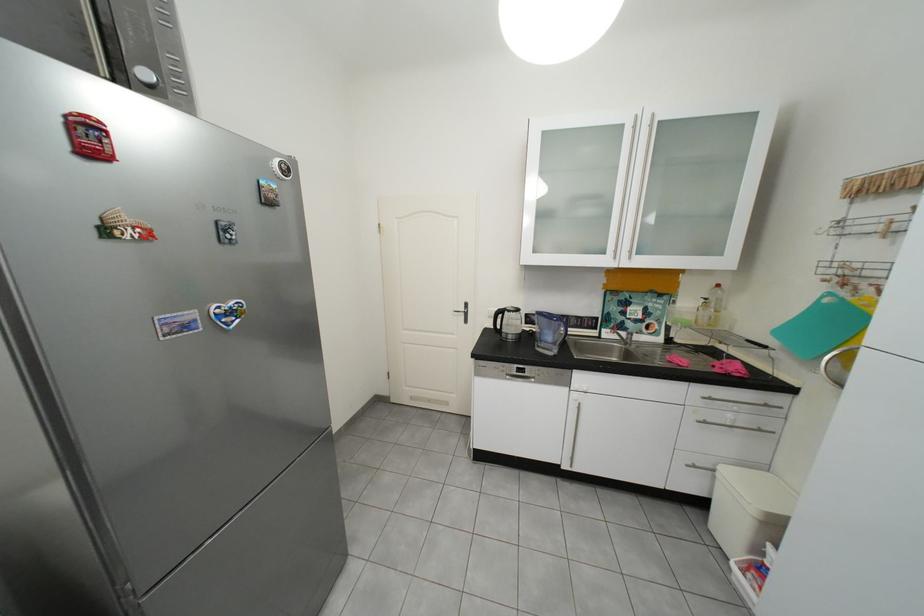
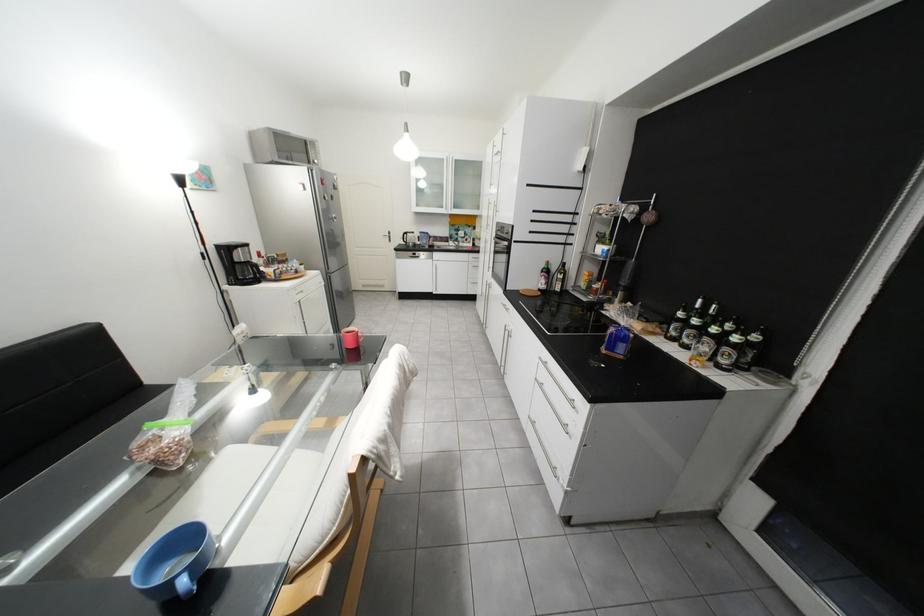
The point at [566,353] is marked in the first image. Where is the corresponding point in the second image?

(439, 248)